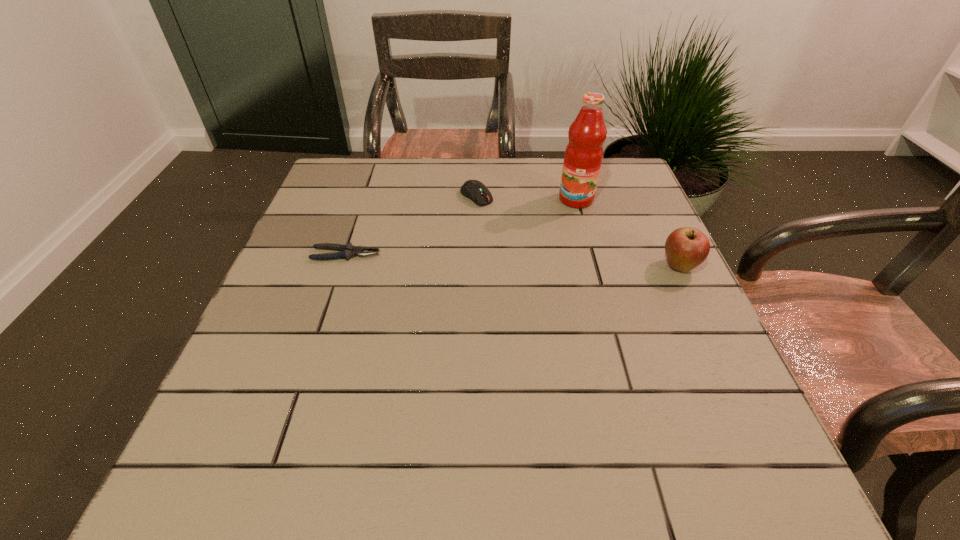
Locate an element on the screen. free point between the computer equipment and the pliers is located at coordinates coord(411,225).

The height and width of the screenshot is (540, 960). In order to click on free space that is in between the rightmost object and the leftmost object in this screenshot , I will do `click(513, 260)`.

You are a GUI agent. You are given a task and a screenshot of the screen. Output one action in this format:
    pyautogui.click(x=<x>, y=<y>)
    Task: Click on the free space between the rightmost object and the computer equipment
    
    Given the screenshot: What is the action you would take?
    pyautogui.click(x=578, y=231)

This screenshot has height=540, width=960. What are the coordinates of `free spot between the fruit juice and the second tallest object` in the screenshot? It's located at (628, 233).

Locate an element on the screen. This screenshot has width=960, height=540. blank region between the rightmost object and the third object from left to right is located at coordinates (628, 233).

Where is `empty space between the leftmost object and the apple`? The width and height of the screenshot is (960, 540). empty space between the leftmost object and the apple is located at coordinates (513, 260).

The width and height of the screenshot is (960, 540). Identify the location of empty location between the shortest object and the apple. click(x=513, y=260).

Find the location of `free space between the shortest object and the rightmost object`. free space between the shortest object and the rightmost object is located at coordinates (513, 260).

The width and height of the screenshot is (960, 540). In order to click on vacant area between the rightmost object and the third tallest object in this screenshot , I will do `click(578, 231)`.

At what (x,y) coordinates should I click in order to perform the action: click on free spot between the rightmost object and the third object from left to right. Please return your answer as a coordinate pair (x, y). Looking at the image, I should click on (628, 233).